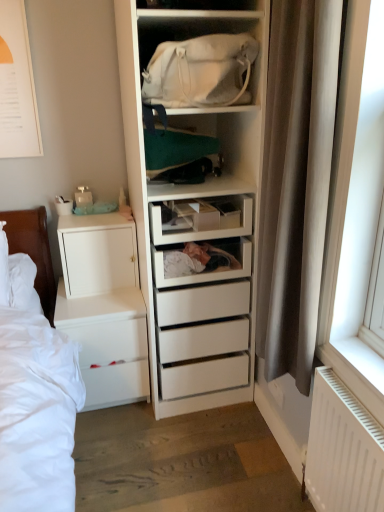
Find the location of `free location in front of white matte cabinet at left`. free location in front of white matte cabinet at left is located at coordinates (94, 304).